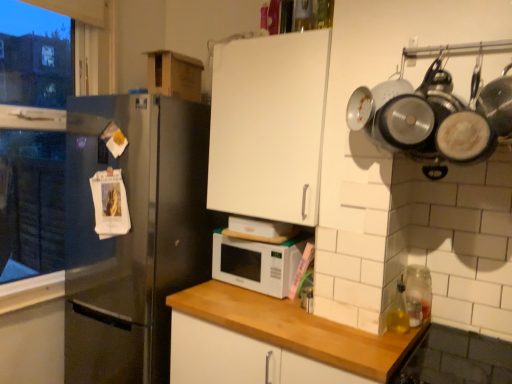
Where is `free space in front of translucent yellow glass at right`? This screenshot has width=512, height=384. free space in front of translucent yellow glass at right is located at coordinates (390, 339).